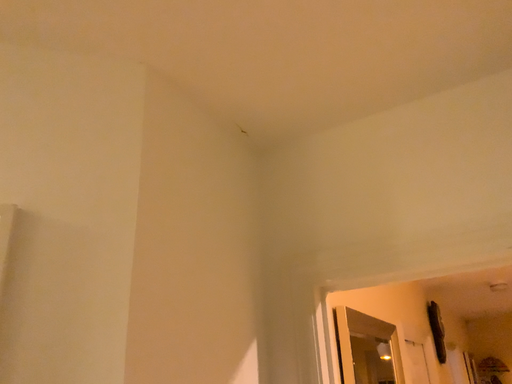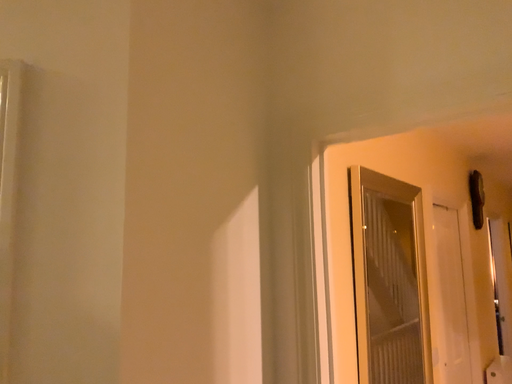
Question: Which way did the camera rotate in the video?

Choices:
 (A) rotated right
 (B) rotated left

Answer: (B)